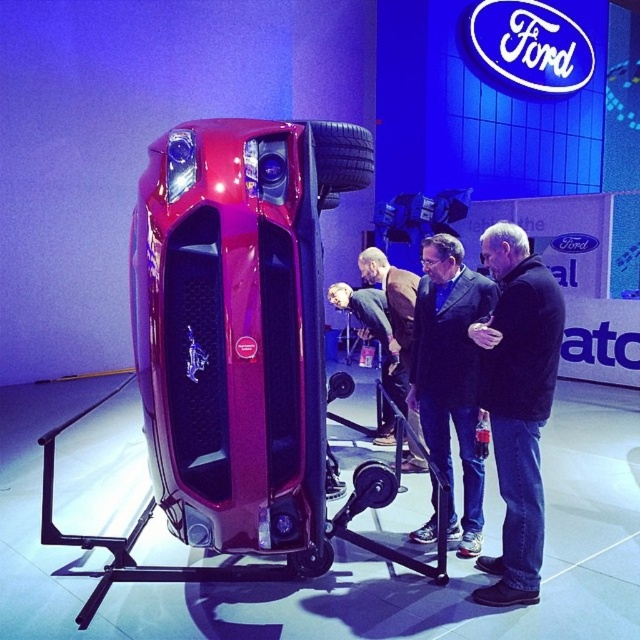
Question: Does dark blue suit at center have a greater width compared to black rubber tire at center?

Choices:
 (A) yes
 (B) no

Answer: (A)

Question: Among these objects, which one is farthest from the camera?

Choices:
 (A) black rubber tire at upper center
 (B) glossy metallic concept car at center
 (C) black leather jacket at center

Answer: (C)

Question: Does glossy metallic concept car at center have a greater width compared to black leather jacket at center?

Choices:
 (A) yes
 (B) no

Answer: (A)

Question: Among these points, which one is nearest to the camera?

Choices:
 (A) (337, 132)
 (B) (294, 564)
 (C) (506, 541)
 (D) (177, 260)

Answer: (D)

Question: Which point is farther from the camera taking this photo?

Choices:
 (A) (346, 380)
 (B) (534, 272)
 (C) (296, 200)

Answer: (A)

Question: Does glossy metallic concept car at center appear under green fabric jacket at center?

Choices:
 (A) yes
 (B) no

Answer: (B)